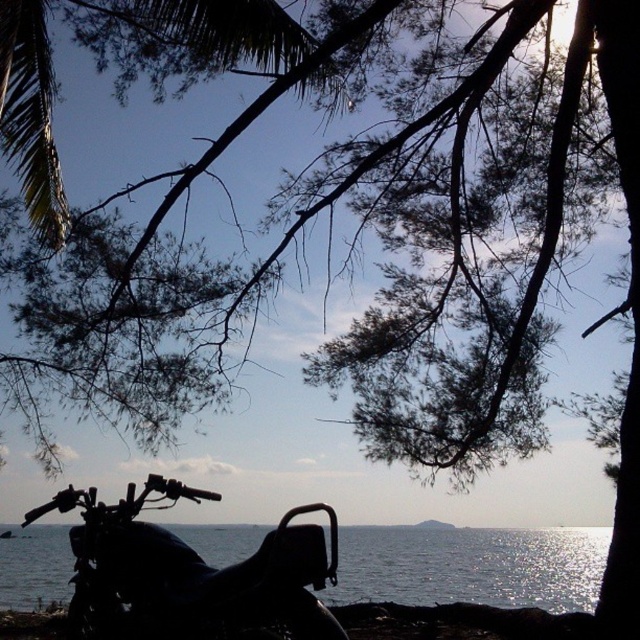
You are a photographer standing at the scene. You want to take a photo of the transparent water at lower center without the black matte motorcycle at lower left blocking the view. Is it possible to do so?

The black matte motorcycle at lower left is above the transparent water at lower center, so it is blocking the view. To capture the transparent water at lower center without obstruction, you would need to move the motorcycle or adjust your angle to avoid its silhouette.

You are a photographer planning to capture the black matte motorcycle at lower left and the transparent water at lower center in a single frame. Considering their sizes, which object should you focus on first to ensure both are clearly visible in your composition?

The black matte motorcycle at lower left is bigger than the transparent water at lower center, so focusing on the motorcycle first will help ensure both objects are clearly visible in the composition.